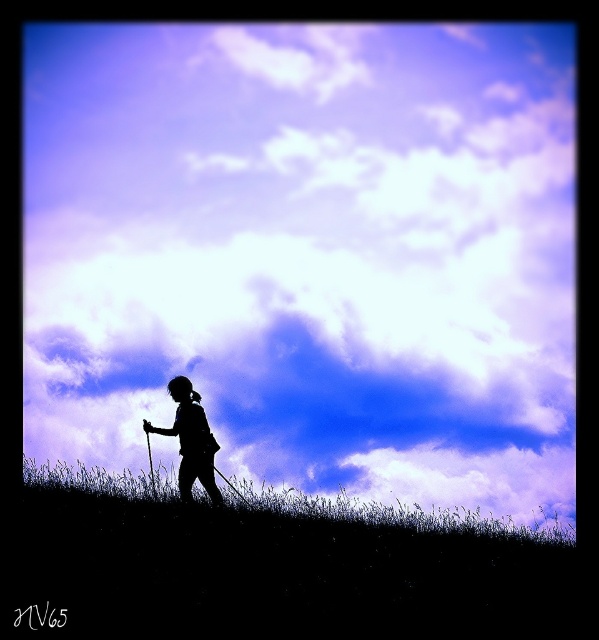
Question: Which object appears farthest from the camera in this image?

Choices:
 (A) white fluffy cloud at upper center
 (B) green grassy at lower center

Answer: (B)

Question: Considering the relative positions of black grass at center and silhouette figure at center in the image provided, where is black grass at center located with respect to silhouette figure at center?

Choices:
 (A) left
 (B) right

Answer: (B)

Question: Considering the relative positions of black grass at center and silhouette figure at center in the image provided, where is black grass at center located with respect to silhouette figure at center?

Choices:
 (A) right
 (B) left

Answer: (A)

Question: Considering the relative positions of white fluffy cloud at upper center and black grass at center in the image provided, where is white fluffy cloud at upper center located with respect to black grass at center?

Choices:
 (A) above
 (B) below

Answer: (A)

Question: Which of the following is the farthest from the observer?

Choices:
 (A) green grassy at lower center
 (B) white fluffy cloud at upper center

Answer: (A)

Question: Which object is closer to the camera taking this photo?

Choices:
 (A) black grass at center
 (B) green grassy at lower center

Answer: (A)